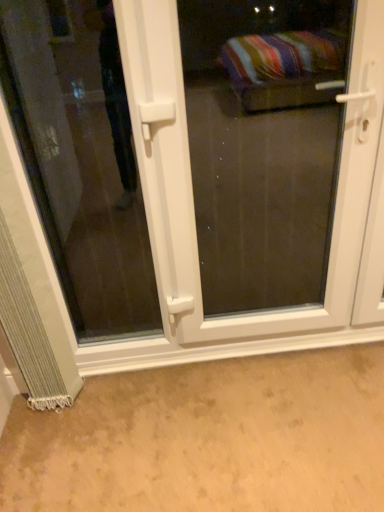
Question: Considering the relative sizes of transparent glass door at lower left and white plastic door at center in the image provided, is transparent glass door at lower left wider than white plastic door at center?

Choices:
 (A) yes
 (B) no

Answer: (B)

Question: Considering the relative positions of transparent glass door at lower left and white plastic door at center in the image provided, is transparent glass door at lower left to the right of white plastic door at center from the viewer's perspective?

Choices:
 (A) no
 (B) yes

Answer: (A)

Question: Considering the relative positions of transparent glass door at lower left and white plastic door at center in the image provided, is transparent glass door at lower left to the left of white plastic door at center from the viewer's perspective?

Choices:
 (A) yes
 (B) no

Answer: (A)

Question: Can you confirm if transparent glass door at lower left is taller than white plastic door at center?

Choices:
 (A) no
 (B) yes

Answer: (A)

Question: From a real-world perspective, is transparent glass door at lower left physically below white plastic door at center?

Choices:
 (A) no
 (B) yes

Answer: (A)

Question: Could you tell me if transparent glass door at lower left is facing white plastic door at center?

Choices:
 (A) no
 (B) yes

Answer: (B)

Question: Is white plastic door at center positioned behind silvery textured curtain at lower left?

Choices:
 (A) yes
 (B) no

Answer: (B)

Question: From the image's perspective, does white plastic door at center appear higher than silvery textured curtain at lower left?

Choices:
 (A) no
 (B) yes

Answer: (B)

Question: From a real-world perspective, is white plastic door at center positioned over silvery textured curtain at lower left based on gravity?

Choices:
 (A) yes
 (B) no

Answer: (A)

Question: Are white plastic door at center and silvery textured curtain at lower left making contact?

Choices:
 (A) no
 (B) yes

Answer: (A)

Question: Does white plastic door at center have a smaller size compared to silvery textured curtain at lower left?

Choices:
 (A) no
 (B) yes

Answer: (A)

Question: Can you confirm if white plastic door at center is wider than silvery textured curtain at lower left?

Choices:
 (A) yes
 (B) no

Answer: (B)

Question: Can you confirm if silvery textured curtain at lower left is wider than transparent glass door at lower left?

Choices:
 (A) no
 (B) yes

Answer: (B)